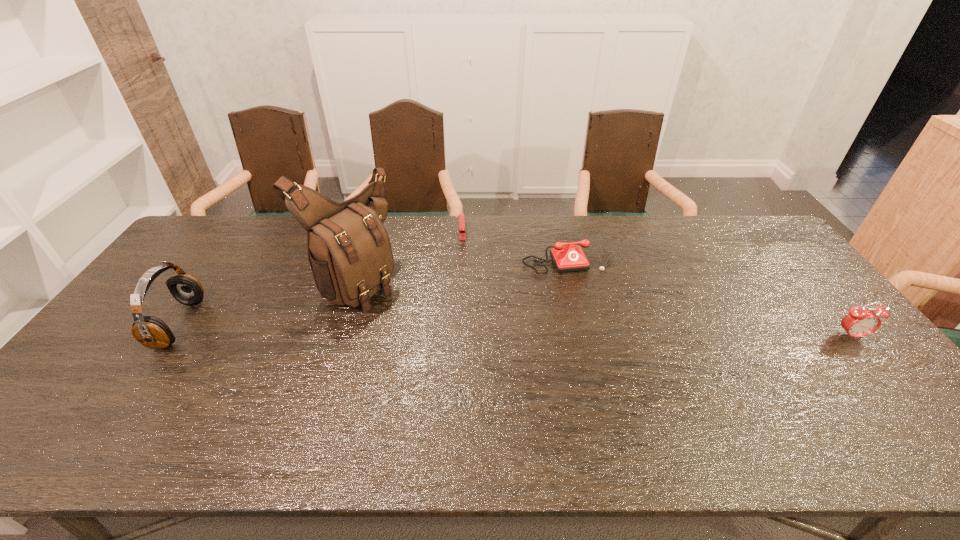
Identify the location of vacant area located 0.130m on the dial of the fourth tallest object. The width and height of the screenshot is (960, 540). (591, 304).

You are a GUI agent. You are given a task and a screenshot of the screen. Output one action in this format:
    pyautogui.click(x=<x>, y=<y>)
    Task: Click on the stapler that is at the far edge
    This screenshot has height=540, width=960.
    Given the screenshot: What is the action you would take?
    pyautogui.click(x=461, y=215)

This screenshot has width=960, height=540. In order to click on shoulder bag located at the far edge in this screenshot , I will do `click(349, 250)`.

Locate an element on the screen. telephone at the far edge is located at coordinates point(569,258).

Where is `object present at the left edge`? The width and height of the screenshot is (960, 540). object present at the left edge is located at coordinates (152, 332).

The height and width of the screenshot is (540, 960). In order to click on object situated at the right edge in this screenshot , I will do `click(860, 322)`.

This screenshot has width=960, height=540. I want to click on blank area at the far edge, so click(445, 247).

Locate an element on the screen. This screenshot has height=540, width=960. vacant space at the near edge is located at coordinates (473, 402).

In the image, there is a desktop. Identify the location of free region at the left edge. (118, 349).

Locate an element on the screen. blank area at the right edge is located at coordinates (797, 292).